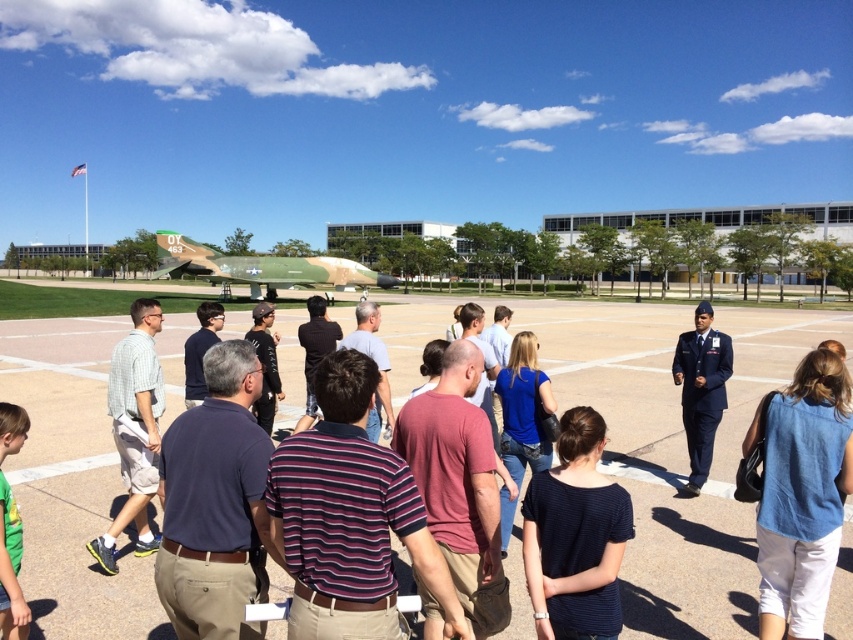
You are standing in the outdoor scene and want to take a photo of the dark blue striped shirt at center. If your camera has a minimum focus distance of 2 meters, will you be able to capture the shirt clearly without moving closer?

The dark blue striped shirt at center is 2.74 meters away from the viewer. Since the minimum focus distance of the camera is 2 meters, the shirt is within the camera range and can be captured clearly.

You are a photographer trying to capture a clear shot of the camouflage paint airplane at center. There is a person wearing a dark blue striped shirt at center blocking your view. Can you determine if the person is shorter than the airplane to see if you can still get a partial view over their head?

The dark blue striped shirt at center is shorter than the camouflage paint airplane at center, so you can still get a partial view over their head.

You are a photographer standing at the back of the group. You want to take a photo of the dark blue striped shirt at center and the dark blue shirt at center so that both are fully visible. Which person should you ask to move forward to ensure the shorter one is not blocked?

The dark blue striped shirt at center is shorter than dark blue shirt at center, so you should ask the dark blue striped shirt at center to move forward to avoid being blocked by the taller dark blue shirt at center.